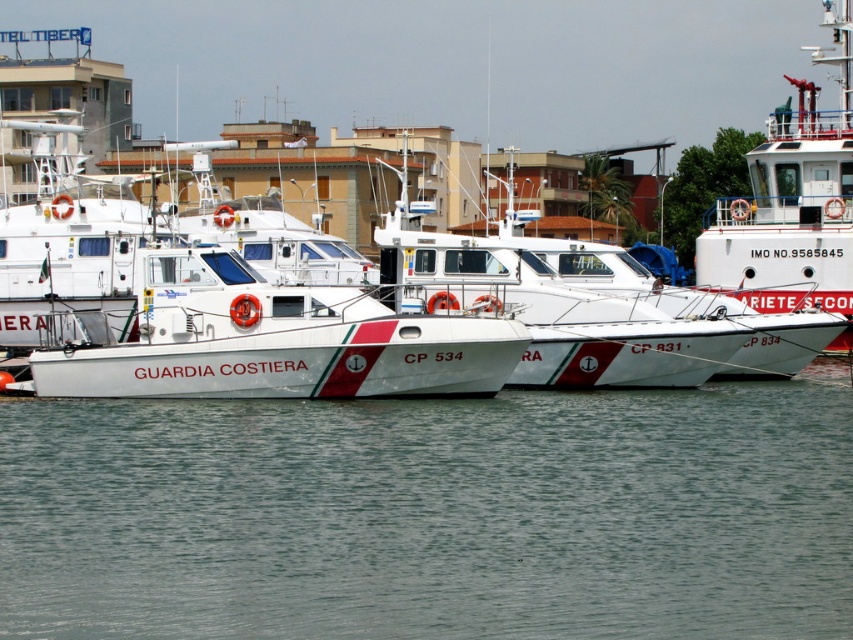
Question: Which object is closer to the camera taking this photo?

Choices:
 (A) white glossy boat at center
 (B) white matte ship at upper right
 (C) clear water at center

Answer: (C)

Question: Among these points, which one is farthest from the camera?

Choices:
 (A) (509, 216)
 (B) (36, 618)

Answer: (A)

Question: Is clear water at center smaller than white glossy boat at center?

Choices:
 (A) no
 (B) yes

Answer: (B)

Question: Considering the relative positions of clear water at center and white glossy boat at center in the image provided, where is clear water at center located with respect to white glossy boat at center?

Choices:
 (A) right
 (B) left

Answer: (B)

Question: Which of these objects is positioned closest to the white matte ship at upper right?

Choices:
 (A) white glossy boat at center
 (B) clear water at center

Answer: (A)

Question: Can you confirm if clear water at center is thinner than white glossy boat at center?

Choices:
 (A) yes
 (B) no

Answer: (B)